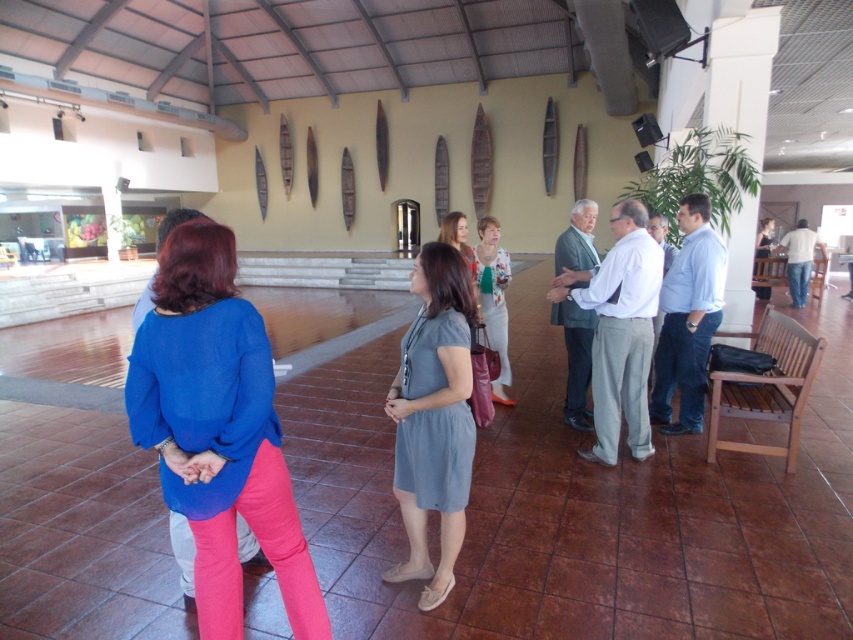
Question: Which object is the closest to the floral print blouse at center?

Choices:
 (A) gray cotton dress at center
 (B) blue cotton blouse at center

Answer: (A)

Question: Does blue cotton blouse at center appear on the right side of floral print blouse at center?

Choices:
 (A) yes
 (B) no

Answer: (B)

Question: Does blue cotton blouse at center come behind gray cotton dress at center?

Choices:
 (A) no
 (B) yes

Answer: (A)

Question: Estimate the real-world distances between objects in this image. Which object is farther from the gray cotton dress at center?

Choices:
 (A) blue cotton blouse at center
 (B) floral print blouse at center

Answer: (B)

Question: Can you confirm if blue cotton blouse at center is positioned above floral print blouse at center?

Choices:
 (A) yes
 (B) no

Answer: (B)

Question: Which object is closer to the camera taking this photo?

Choices:
 (A) blue cotton blouse at center
 (B) gray cotton dress at center
 (C) floral print blouse at center

Answer: (A)